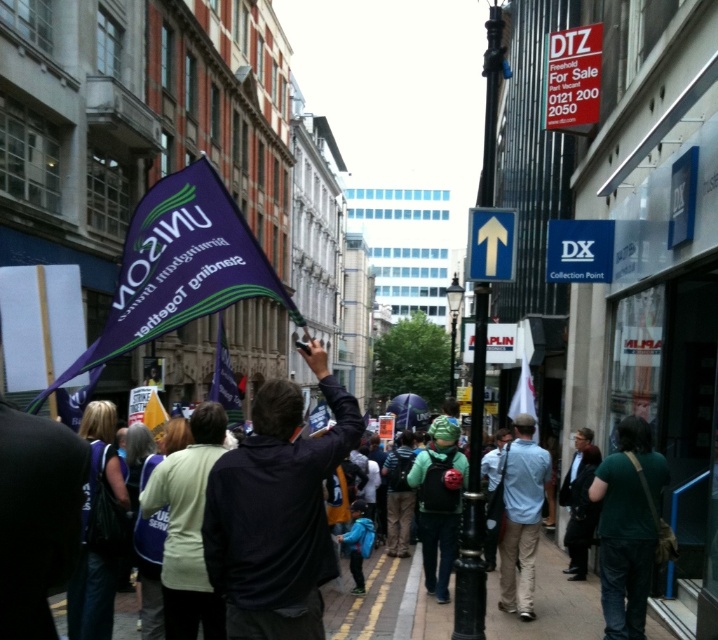
You are a photographer standing in the crowd at the event. You want to take a photo of the green matte jacket at center without the black metal pole at center blocking it. What should you do?

The black metal pole at center is positioned over the green matte jacket at center, so you should move to the side to avoid the pole blocking the jacket.

You are a photographer trying to capture a clear shot of the dark blue jacket at center and the green fabric jacket at center. Which jacket should you focus on first if you want to ensure both are in frame without moving the camera?

The dark blue jacket at center is above the green fabric jacket at center, so you should focus on the dark blue jacket at center first to ensure both are in frame without moving the camera.